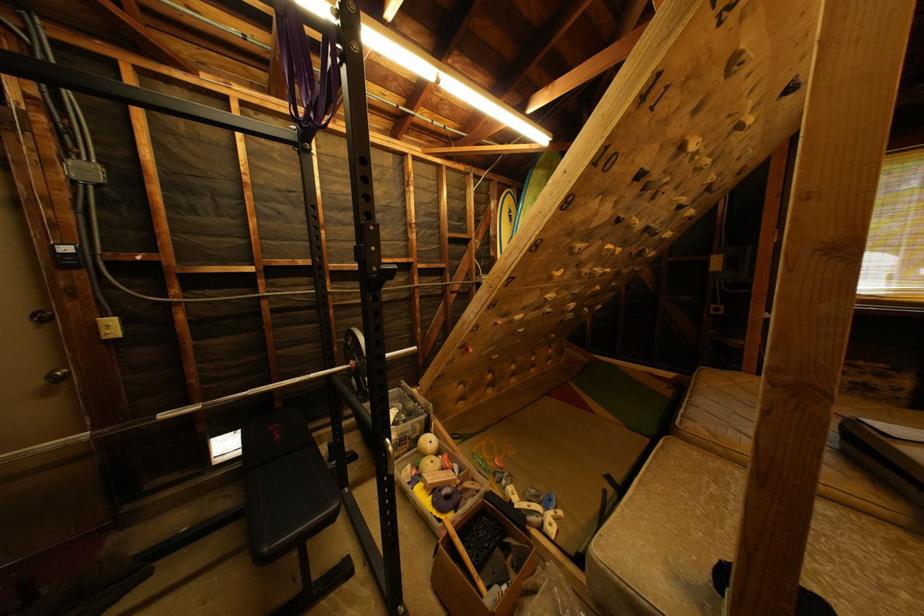
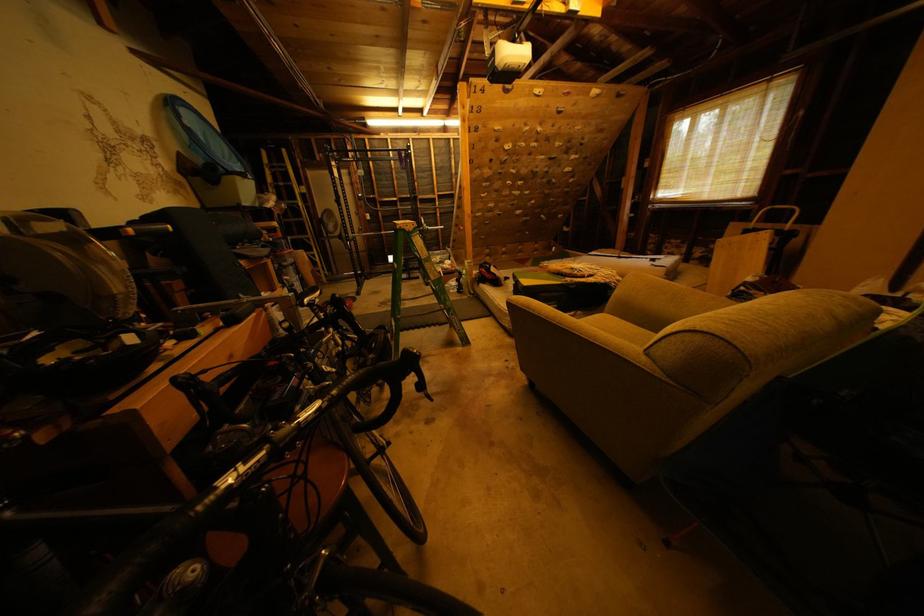
The images are taken continuously from a first-person perspective. In which direction are you moving?

The movement direction of the cameraman is right, backward.